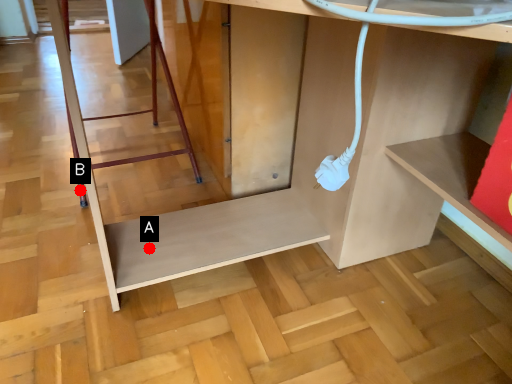
Question: Two points are circled on the image, labeled by A and B beside each circle. Which point is farther from the camera taking this photo?

Choices:
 (A) A is further
 (B) B is further

Answer: (B)